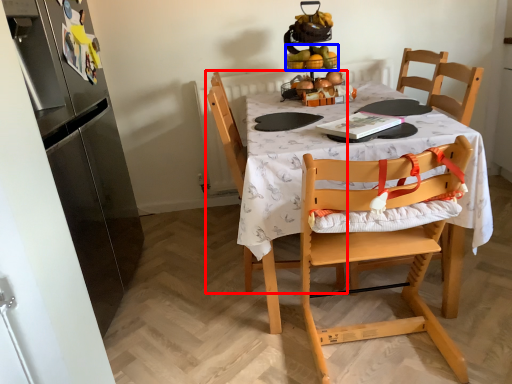
Question: Which object appears closest to the camera in this image, chair (highlighted by a red box) or fruit (highlighted by a blue box)?

Choices:
 (A) chair
 (B) fruit

Answer: (A)